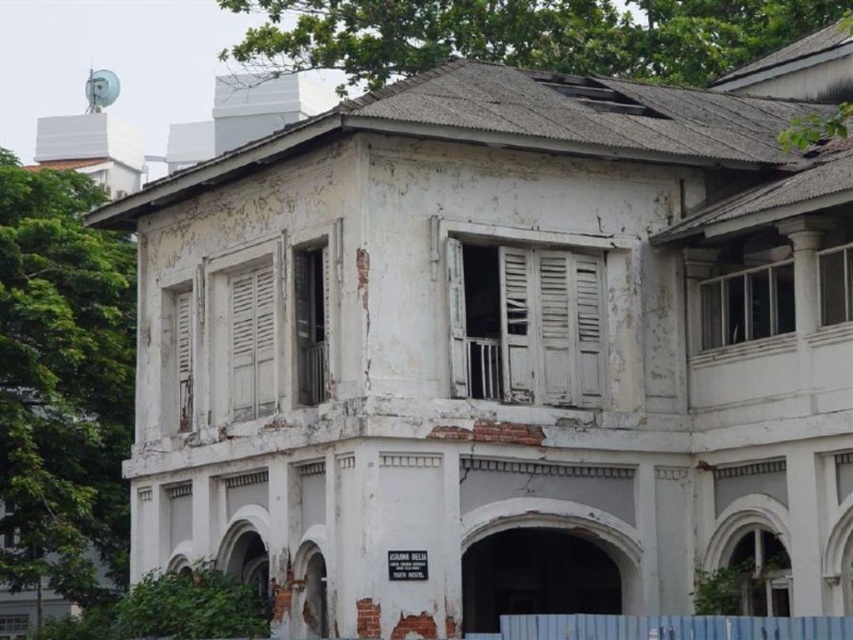
Is white matte shutters at center to the right of white wooden shutter at left from the viewer's perspective?

Correct, you'll find white matte shutters at center to the right of white wooden shutter at left.

Between white matte shutters at center and white wooden shutter at left, which one is positioned higher?

white matte shutters at center

Between point (581, 380) and point (239, 360), which one is positioned in front?

Positioned in front is point (581, 380).

You are a GUI agent. You are given a task and a screenshot of the screen. Output one action in this format:
    pyautogui.click(x=<x>, y=<y>)
    Task: Click on the white matte shutters at center
    The width and height of the screenshot is (853, 640).
    Given the screenshot: What is the action you would take?
    pyautogui.click(x=550, y=326)